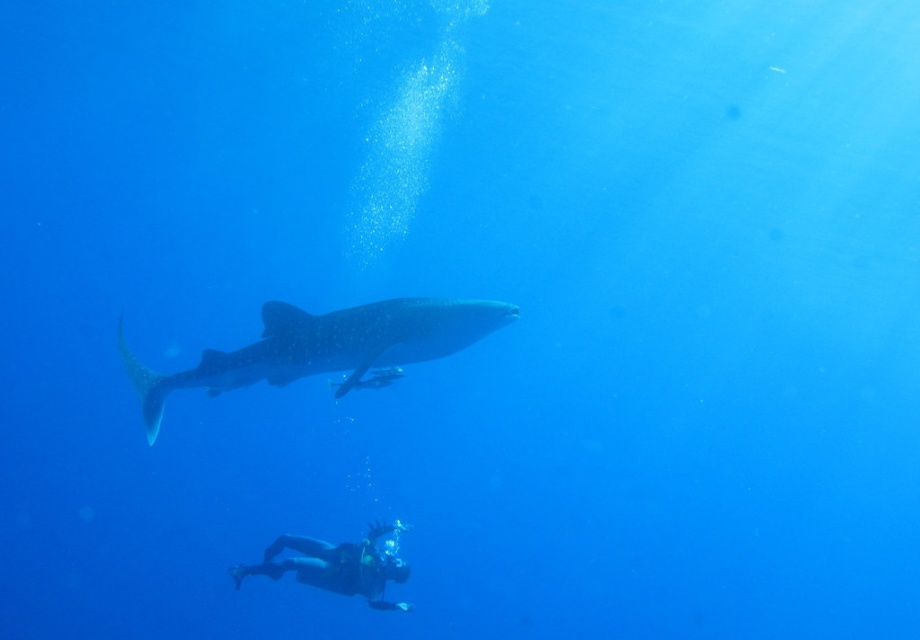
Can you confirm if speckled skin whale shark at center is bigger than black scuba diver at lower center?

Indeed, speckled skin whale shark at center has a larger size compared to black scuba diver at lower center.

Can you confirm if speckled skin whale shark at center is positioned to the right of black scuba diver at lower center?

Indeed, speckled skin whale shark at center is positioned on the right side of black scuba diver at lower center.

Which is in front, point (493, 307) or point (388, 570)?

Point (493, 307) is more forward.

This screenshot has width=920, height=640. Find the location of `speckled skin whale shark at center`. speckled skin whale shark at center is located at coordinates (324, 346).